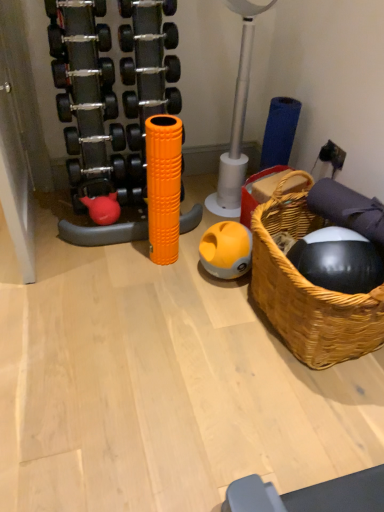
Question: In terms of size, does orange foam roller at center appear bigger or smaller than woven wood basket at right?

Choices:
 (A) big
 (B) small

Answer: (B)

Question: From the image's perspective, relative to woven wood basket at right, is orange foam roller at center above or below?

Choices:
 (A) below
 (B) above

Answer: (B)

Question: Which is farther from the yellow matte ball at center?

Choices:
 (A) orange foam roller at center
 (B) woven wood basket at right

Answer: (B)

Question: Which of these objects is positioned closest to the woven wood basket at right?

Choices:
 (A) orange foam roller at center
 (B) yellow matte ball at center

Answer: (B)